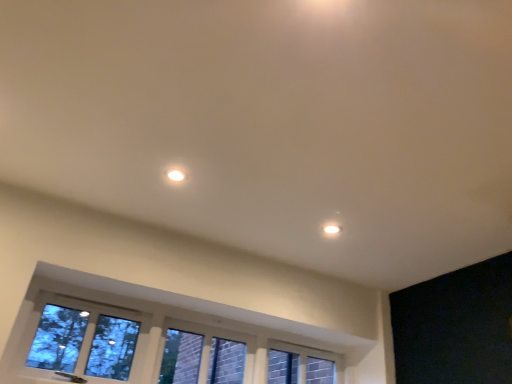
In order to face clear glass window at lower center, should I rotate leftwards or rightwards?

To face it directly, rotate left by 3.986 degrees.

This screenshot has width=512, height=384. I want to click on clear glass window at lower center, so click(193, 319).

Image resolution: width=512 pixels, height=384 pixels. Describe the element at coordinates (193, 319) in the screenshot. I see `clear glass window at lower center` at that location.

Locate an element on the screen. clear glass window at lower center is located at coordinates (193, 319).